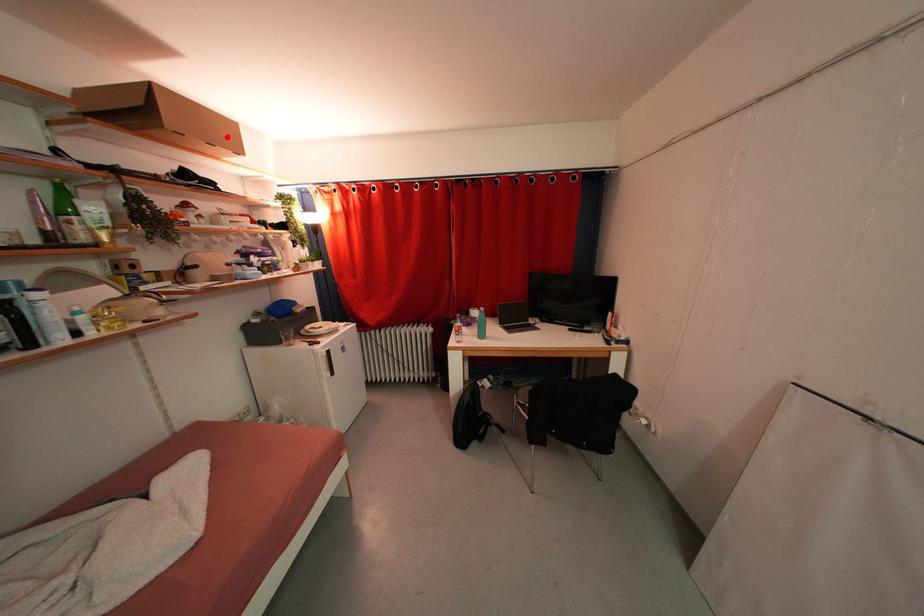
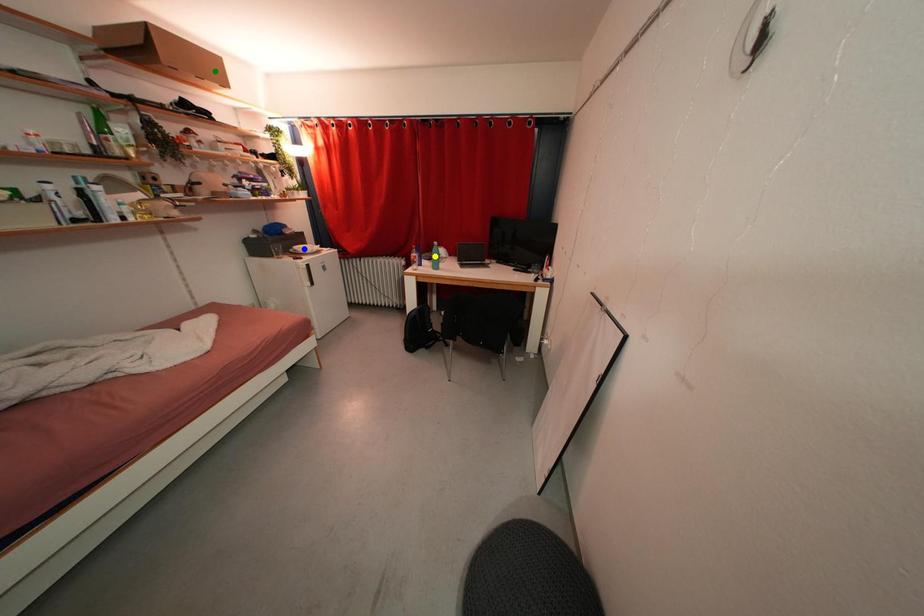
Question: I am providing you with two images of the same scene from different viewpoints. A red point is marked on the first image. You are given multiple points on the second image. Which point in image 2 is actually the same real-world point as the red point in image 1?

Choices:
 (A) green point
 (B) yellow point
 (C) blue point

Answer: (A)